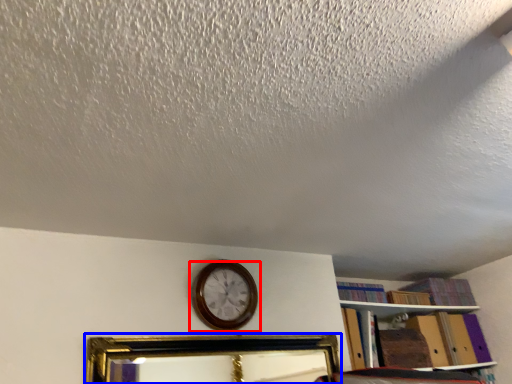
Question: Which point is further to the camera, wall clock (highlighted by a red box) or picture frame (highlighted by a blue box)?

Choices:
 (A) wall clock
 (B) picture frame

Answer: (A)